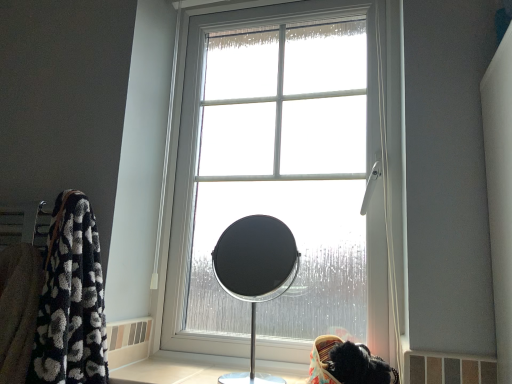
I want to click on matte black mirror at center, so click(x=255, y=273).

Describe the element at coordinates (255, 273) in the screenshot. The width and height of the screenshot is (512, 384). I see `matte black mirror at center` at that location.

Describe the element at coordinates (288, 176) in the screenshot. I see `clear glass window at center` at that location.

Locate an element on the screen. Image resolution: width=512 pixels, height=384 pixels. clear glass window at center is located at coordinates (288, 176).

Where is `matte black mirror at center`? matte black mirror at center is located at coordinates (255, 273).

Considering the positions of objects clear glass window at center and matte black mirror at center in the image provided, who is more to the left, clear glass window at center or matte black mirror at center?

matte black mirror at center.

In the image, is clear glass window at center positioned in front of or behind matte black mirror at center?

clear glass window at center is positioned farther from the viewer than matte black mirror at center.

Between point (176, 208) and point (250, 239), which one is positioned behind?

The point (250, 239) is farther.

From the image's perspective, is clear glass window at center positioned above or below matte black mirror at center?

From the image's perspective, clear glass window at center appears above matte black mirror at center.

From a real-world perspective, is clear glass window at center above or below matte black mirror at center?

clear glass window at center is situated higher than matte black mirror at center in the real world.

Which object is wider, clear glass window at center or matte black mirror at center?

matte black mirror at center is wider.

Does clear glass window at center have a greater height compared to matte black mirror at center?

Yes, clear glass window at center is taller than matte black mirror at center.

Is clear glass window at center bigger than matte black mirror at center?

Indeed, clear glass window at center has a larger size compared to matte black mirror at center.

Consider the image. Choose the correct answer: Is clear glass window at center inside matte black mirror at center or outside it?

The correct answer is: outside.

Is clear glass window at center far from matte black mirror at center?

Yes.

Is clear glass window at center turned away from matte black mirror at center?

Absolutely, clear glass window at center is directed away from matte black mirror at center.

Can you tell me how much clear glass window at center and matte black mirror at center differ in facing direction?

The angular difference between clear glass window at center and matte black mirror at center is 0.639 degrees.

The width and height of the screenshot is (512, 384). Identify the location of window above the matte black mirror at center (from a real-world perspective). (288, 176).

Is matte black mirror at center at the left side of clear glass window at center?

Yes, matte black mirror at center is to the left of clear glass window at center.

From the picture: Considering their positions, is matte black mirror at center located in front of or behind clear glass window at center?

matte black mirror at center is in front of clear glass window at center.

Is point (255, 330) farther from viewer compared to point (362, 7)?

No, it is in front of (362, 7).

From the image's perspective, would you say matte black mirror at center is shown under clear glass window at center?

Yes.

From a real-world perspective, who is located higher, matte black mirror at center or clear glass window at center?

clear glass window at center, from a real-world perspective.

In terms of width, does matte black mirror at center look wider or thinner when compared to clear glass window at center?

matte black mirror at center is wider than clear glass window at center.

Considering the sizes of objects matte black mirror at center and clear glass window at center in the image provided, who is shorter, matte black mirror at center or clear glass window at center?

matte black mirror at center is shorter.

Between matte black mirror at center and clear glass window at center, which one has smaller size?

With smaller size is matte black mirror at center.

Consider the image. Is matte black mirror at center not within clear glass window at center?

Yes.

Would you say matte black mirror at center is a long distance from clear glass window at center?

Yes.

Is matte black mirror at center aimed at clear glass window at center?

No.

How distant is matte black mirror at center from clear glass window at center?

matte black mirror at center is 4.32 feet from clear glass window at center.

At what (x,y) coordinates should I click in order to perform the action: click on window that appears above the matte black mirror at center (from a real-world perspective). Please return your answer as a coordinate pair (x, y). This screenshot has width=512, height=384. Looking at the image, I should click on click(288, 176).

In order to click on window lying behind the matte black mirror at center in this screenshot , I will do `click(288, 176)`.

Locate an element on the screen. Image resolution: width=512 pixels, height=384 pixels. table lamp that is in front of the clear glass window at center is located at coordinates (255, 273).